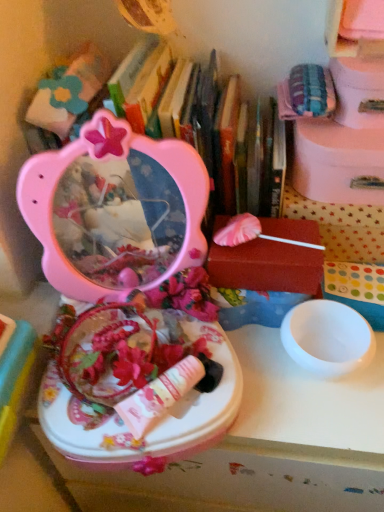
The width and height of the screenshot is (384, 512). What do you see at coordinates (338, 163) in the screenshot?
I see `pink cardboard box at upper right, the 2th storage box viewed from the top` at bounding box center [338, 163].

Find the location of a particular element. white polka dot fabric at upper right, the second storage box when ordered from bottom to top is located at coordinates (341, 227).

Image resolution: width=384 pixels, height=512 pixels. I want to click on matte pink vanity at center, so click(x=128, y=297).

The height and width of the screenshot is (512, 384). Identify the location of pink matte lollipop at center, which ranks as the first storage box in bottom-to-top order. (266, 267).

Find the location of `pink plastic storage box at upper right, marked as the fourth storage box in a bottom-to-top arrangement`. pink plastic storage box at upper right, marked as the fourth storage box in a bottom-to-top arrangement is located at coordinates (359, 92).

Image resolution: width=384 pixels, height=512 pixels. What do you see at coordinates (278, 440) in the screenshot?
I see `white glossy table at center` at bounding box center [278, 440].

Image resolution: width=384 pixels, height=512 pixels. What do you see at coordinates (327, 338) in the screenshot?
I see `white glossy bowl at right` at bounding box center [327, 338].

Locate an element on the screen. white glossy bowl at right is located at coordinates (327, 338).

Find the location of a particular element. The height and width of the screenshot is (512, 384). pink cardboard box at upper right, acting as the 3th storage box starting from the bottom is located at coordinates (338, 163).

Which is more to the left, pink plastic mirror at upper left or white glossy bowl at right?

pink plastic mirror at upper left is more to the left.

Image resolution: width=384 pixels, height=512 pixels. In order to click on book above the white glossy bowl at right (from a real-world perspective) in this screenshot , I will do click(x=189, y=124).

From the picture: Which of these two, pink plastic mirror at upper left or white glossy bowl at right, stands taller?

With more height is pink plastic mirror at upper left.

Does pink plastic mirror at upper left lie in front of white glossy bowl at right?

Yes.

The width and height of the screenshot is (384, 512). There is a white glossy bowl at right. Find the location of `the 4th storage box above it (from the image's perspective)`. the 4th storage box above it (from the image's perspective) is located at coordinates (359, 92).

Between pink plastic storage box at upper right, marked as the first storage box in a top-to-bottom arrangement, and white glossy bowl at right, which one has less height?

Standing shorter between the two is white glossy bowl at right.

Looking at this image, from the image's perspective, is pink plastic storage box at upper right, marked as the fourth storage box in a bottom-to-top arrangement, located beneath white glossy bowl at right?

Result: No, from the image's perspective, pink plastic storage box at upper right, marked as the fourth storage box in a bottom-to-top arrangement, is not below white glossy bowl at right.

Does point (81, 199) appear closer or farther from the camera than point (300, 126)?

Point (81, 199) is positioned farther from the camera compared to point (300, 126).

Looking at this image, can you confirm if matte pink vanity at center is wider than pink cardboard box at upper right, acting as the 3th storage box starting from the bottom?

No, matte pink vanity at center is not wider than pink cardboard box at upper right, acting as the 3th storage box starting from the bottom.

Considering the positions of objects matte pink vanity at center and pink cardboard box at upper right, the 2th storage box viewed from the top, in the image provided, who is more to the right, matte pink vanity at center or pink cardboard box at upper right, the 2th storage box viewed from the top,?

Positioned to the right is pink cardboard box at upper right, the 2th storage box viewed from the top.

Considering the sizes of matte pink vanity at center and pink cardboard box at upper right, acting as the 3th storage box starting from the bottom, in the image, is matte pink vanity at center taller or shorter than pink cardboard box at upper right, acting as the 3th storage box starting from the bottom,?

In the image, matte pink vanity at center appears to be taller than pink cardboard box at upper right, acting as the 3th storage box starting from the bottom.

Considering the sizes of objects white glossy bowl at right and white glossy table at center in the image provided, who is shorter, white glossy bowl at right or white glossy table at center?

→ With less height is white glossy bowl at right.

Does white glossy bowl at right appear on the left side of white glossy table at center?

In fact, white glossy bowl at right is to the right of white glossy table at center.

What's the angular difference between white glossy bowl at right and white glossy table at center's facing directions?

2.55 degrees separate the facing orientations of white glossy bowl at right and white glossy table at center.

Find the location of a particular element. The width and height of the screenshot is (384, 512). bowl behind the white glossy table at center is located at coordinates (327, 338).

Is white glossy table at center taller or shorter than pink matte lollipop at center, which ranks as the first storage box in bottom-to-top order?

white glossy table at center is taller than pink matte lollipop at center, which ranks as the first storage box in bottom-to-top order.

Is white glossy table at center thinner than pink matte lollipop at center, which ranks as the 4th storage box in top-to-bottom order?

Incorrect, the width of white glossy table at center is not less than that of pink matte lollipop at center, which ranks as the 4th storage box in top-to-bottom order.

From a real-world perspective, is white glossy table at center above or below pink matte lollipop at center, which ranks as the 4th storage box in top-to-bottom order?

white glossy table at center is situated lower than pink matte lollipop at center, which ranks as the 4th storage box in top-to-bottom order, in the real world.

Consider the image. What's the angular difference between pink plastic mirror at upper left and matte pink vanity at center's facing directions?

pink plastic mirror at upper left and matte pink vanity at center are facing 26.4 degrees away from each other.

Could you tell me if pink plastic mirror at upper left is facing matte pink vanity at center?

Yes, pink plastic mirror at upper left is aimed at matte pink vanity at center.

Can you confirm if pink plastic mirror at upper left is thinner than matte pink vanity at center?

In fact, pink plastic mirror at upper left might be wider than matte pink vanity at center.

Does point (277, 193) lie in front of point (99, 433)?

No, (277, 193) is further to viewer.

Consider the image. Which point is more distant from viewer, (196, 83) or (346, 147)?

Point (196, 83)

Between pink plastic mirror at upper left and pink cardboard box at upper right, acting as the 3th storage box starting from the bottom, which one has larger size?

pink plastic mirror at upper left.

From the image's perspective, would you say pink plastic mirror at upper left is shown under pink cardboard box at upper right, acting as the 3th storage box starting from the bottom?

Yes.

Who is shorter, pink plastic mirror at upper left or pink cardboard box at upper right, acting as the 3th storage box starting from the bottom?

pink cardboard box at upper right, acting as the 3th storage box starting from the bottom, is shorter.

Identify the location of bowl that is below the pink plastic mirror at upper left (from the image's perspective). The height and width of the screenshot is (512, 384). (327, 338).

From a real-world perspective, which storage box is the 4th one above the white glossy bowl at right? Please provide its 2D coordinates.

[(359, 92)]

Estimate the real-world distances between objects in this image. Which object is further from white polka dot fabric at upper right, the second storage box when ordered from bottom to top, matte pink vanity at center or white glossy bowl at right?

The object further to white polka dot fabric at upper right, the second storage box when ordered from bottom to top, is matte pink vanity at center.

Which object lies further to the anchor point white glossy bowl at right, white polka dot fabric at upper right, the second storage box when ordered from bottom to top, or pink plastic storage box at upper right, marked as the first storage box in a top-to-bottom arrangement?

The object further to white glossy bowl at right is pink plastic storage box at upper right, marked as the first storage box in a top-to-bottom arrangement.

Consider the image. Looking at the image, which one is located closer to pink plastic storage box at upper right, marked as the first storage box in a top-to-bottom arrangement, matte pink vanity at center or white glossy table at center?

Based on the image, matte pink vanity at center appears to be nearer to pink plastic storage box at upper right, marked as the first storage box in a top-to-bottom arrangement.

From the image, which object appears to be farther from white glossy table at center, matte pink vanity at center or white polka dot fabric at upper right, the second storage box when ordered from bottom to top?

Based on the image, white polka dot fabric at upper right, the second storage box when ordered from bottom to top, appears to be further to white glossy table at center.

Looking at the image, which one is located closer to matte pink vanity at center, white glossy table at center or pink matte lollipop at center, which ranks as the first storage box in bottom-to-top order?

Among the two, white glossy table at center is located nearer to matte pink vanity at center.

When comparing their distances from pink plastic mirror at upper left, does white glossy table at center or pink matte lollipop at center, which ranks as the first storage box in bottom-to-top order, seem further?

The object further to pink plastic mirror at upper left is white glossy table at center.

Looking at the image, which one is located further to pink matte lollipop at center, which ranks as the 4th storage box in top-to-bottom order, white glossy bowl at right or pink plastic mirror at upper left?

Based on the image, pink plastic mirror at upper left appears to be further to pink matte lollipop at center, which ranks as the 4th storage box in top-to-bottom order.

Considering their positions, is pink cardboard box at upper right, the 2th storage box viewed from the top, positioned closer to pink plastic storage box at upper right, marked as the first storage box in a top-to-bottom arrangement, than matte pink vanity at center?

pink cardboard box at upper right, the 2th storage box viewed from the top, lies closer to pink plastic storage box at upper right, marked as the first storage box in a top-to-bottom arrangement, than the other object.

This screenshot has width=384, height=512. Identify the location of toy between pink plastic mirror at upper left and white glossy bowl at right in the vertical direction. (128, 297).

The height and width of the screenshot is (512, 384). Find the location of `bowl between white polka dot fabric at upper right, arranged as the third storage box when viewed from the top, and white glossy table at center from top to bottom`. bowl between white polka dot fabric at upper right, arranged as the third storage box when viewed from the top, and white glossy table at center from top to bottom is located at coordinates (327, 338).

Find the location of a particular element. toy between pink cardboard box at upper right, acting as the 3th storage box starting from the bottom, and white glossy table at center vertically is located at coordinates (128, 297).

Locate an element on the screen. This screenshot has height=512, width=384. storage box that lies between pink cardboard box at upper right, acting as the 3th storage box starting from the bottom, and pink matte lollipop at center, which ranks as the 4th storage box in top-to-bottom order, from top to bottom is located at coordinates (341, 227).